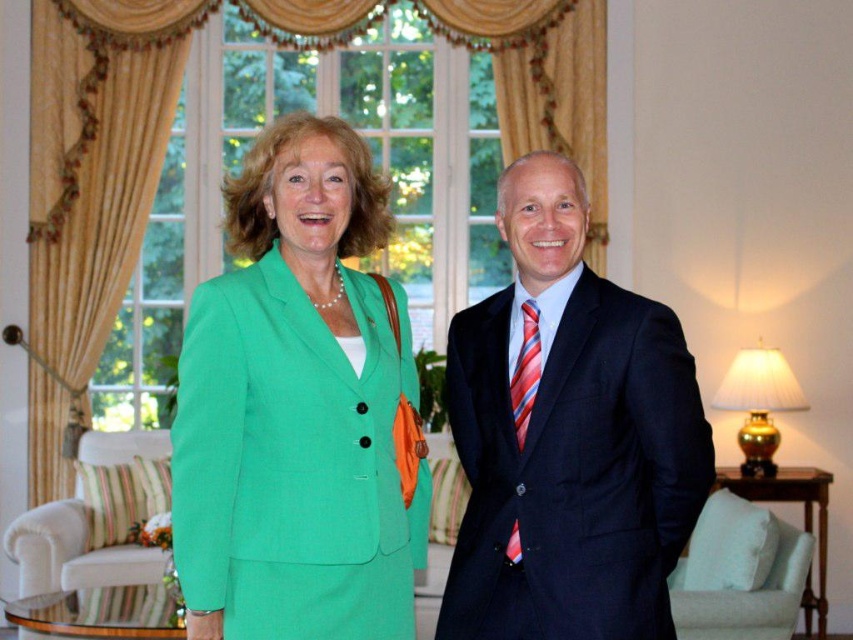
You are a photographer adjusting the camera settings for a portrait. The camera is focused on the navy blue suit at center. If the camera has a depth of field that can clearly capture objects within a 6 inch range, will the striped fabric tie at center also be in focus?

The navy blue suit at center is 6.19 inches away from the striped fabric tie at center. Since the depth of field can only capture objects within a 6 inch range, the striped fabric tie at center will be slightly out of focus.

You are a photographer setting up for a group photo. You need to ensure that the green fabric suit at left and the striped fabric tie at center are at least 20 inches apart for proper framing. Based on the scene, will their current positioning meet this requirement?

The green fabric suit at left and striped fabric tie at center are currently 19.11 inches apart, which is less than the required 20 inches. Therefore, their current positioning does not meet the requirement.